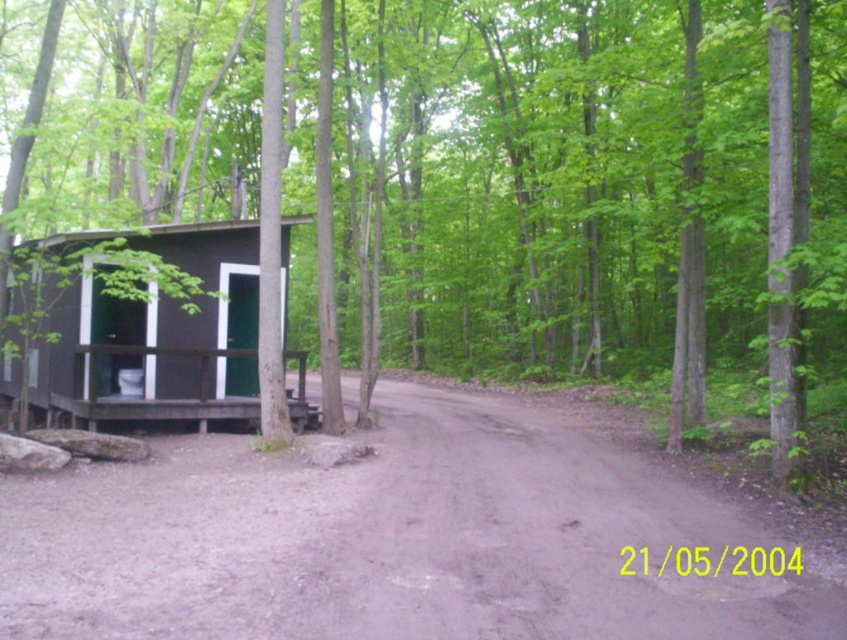
Question: Which point is farther to the camera?

Choices:
 (A) (455, 432)
 (B) (25, 259)

Answer: (A)

Question: Is brown dirt track at center positioned behind black wood cabin at left?

Choices:
 (A) yes
 (B) no

Answer: (B)

Question: Among these objects, which one is farthest from the camera?

Choices:
 (A) black wood cabin at left
 (B) brown dirt track at center

Answer: (A)

Question: Can you confirm if brown dirt track at center is smaller than black wood cabin at left?

Choices:
 (A) yes
 (B) no

Answer: (B)

Question: Can you confirm if brown dirt track at center is wider than black wood cabin at left?

Choices:
 (A) yes
 (B) no

Answer: (A)